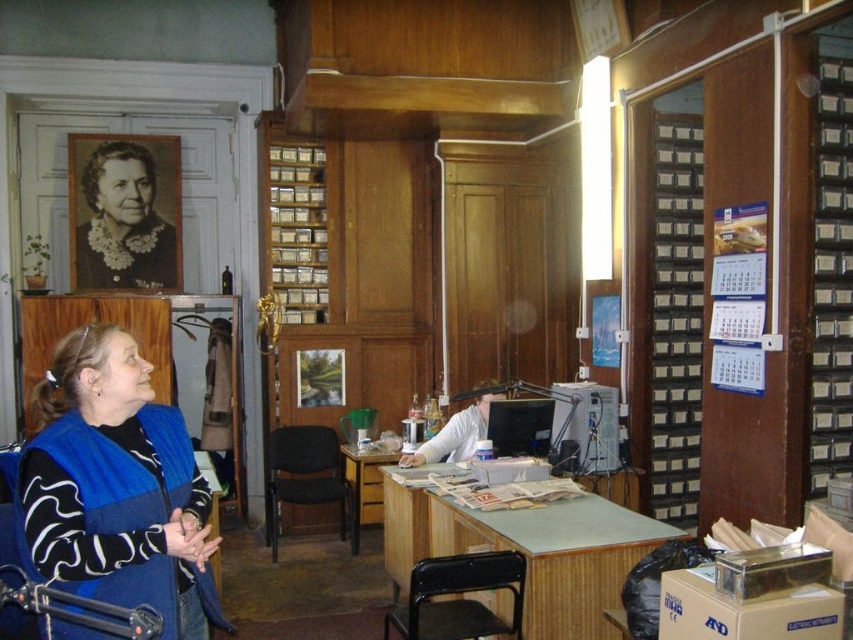
Question: Observing the image, what is the correct spatial positioning of blue fleece vest at left in reference to matte black portrait at upper left?

Choices:
 (A) right
 (B) left

Answer: (A)

Question: Based on their relative distances, which object is farther from the light brown wooden desk at center?

Choices:
 (A) black plastic chair at center
 (B) green laminate table at center
 (C) blue fleece vest at left
 (D) matte black portrait at upper left

Answer: (C)

Question: Is green laminate table at center to the right of black plastic chair at lower center from the viewer's perspective?

Choices:
 (A) no
 (B) yes

Answer: (B)

Question: Which object appears farthest from the camera in this image?

Choices:
 (A) black plastic chair at center
 (B) matte black portrait at upper left

Answer: (B)

Question: Which of these objects is positioned farthest from the wooden cabinet at right?

Choices:
 (A) matte black portrait at upper left
 (B) black plastic chair at lower center
 (C) green laminate table at center

Answer: (A)

Question: Can you confirm if matte black portrait at upper left is thinner than light brown wooden desk at center?

Choices:
 (A) no
 (B) yes

Answer: (A)